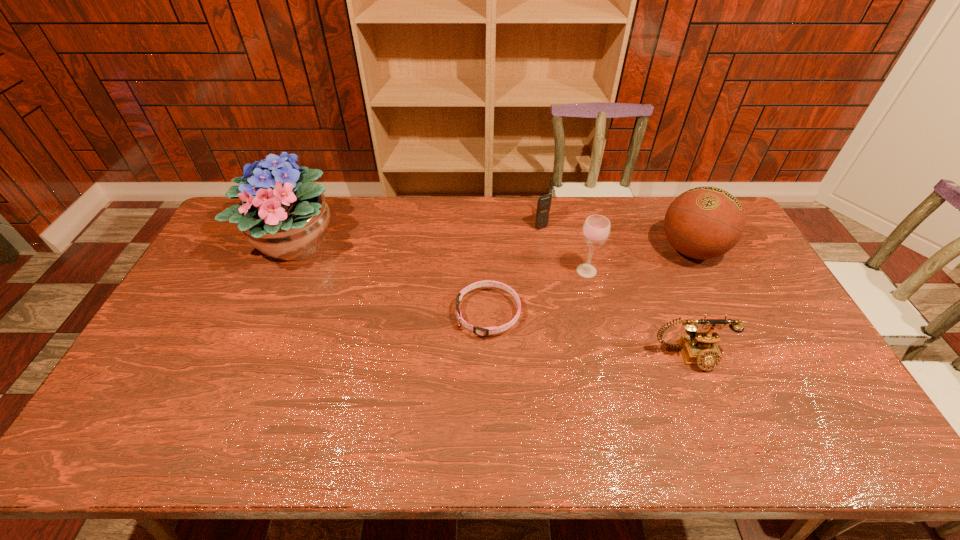
Select which object is the fifth closest to the fourth object from right to left. Please provide its 2D coordinates. Your answer should be formatted as a tuple, i.e. [(x, y)], where the tuple contains the x and y coordinates of a point satisfying the conditions above.

[(282, 214)]

Where is `free space in the image that satisfies the following two spatial constraints: 1. on the back side of the basketball; 2. on the right side of the third tallest object`? The image size is (960, 540). free space in the image that satisfies the following two spatial constraints: 1. on the back side of the basketball; 2. on the right side of the third tallest object is located at coordinates (582, 250).

Where is `vacant space that satisfies the following two spatial constraints: 1. on the keyboard of the third object from left to right; 2. on the left side of the basketball`? vacant space that satisfies the following two spatial constraints: 1. on the keyboard of the third object from left to right; 2. on the left side of the basketball is located at coordinates (545, 250).